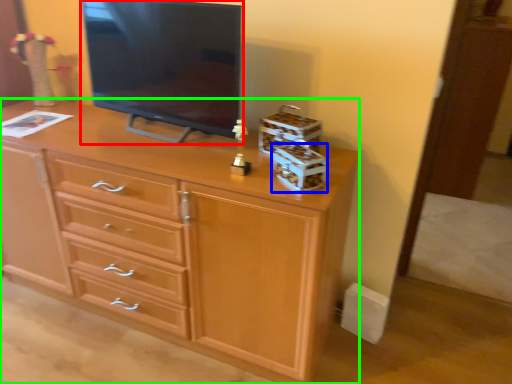
Question: Which object is positioned farthest from television (highlighted by a red box)? Select from storage box (highlighted by a blue box) and chest of drawers (highlighted by a green box).

Choices:
 (A) storage box
 (B) chest of drawers

Answer: (A)